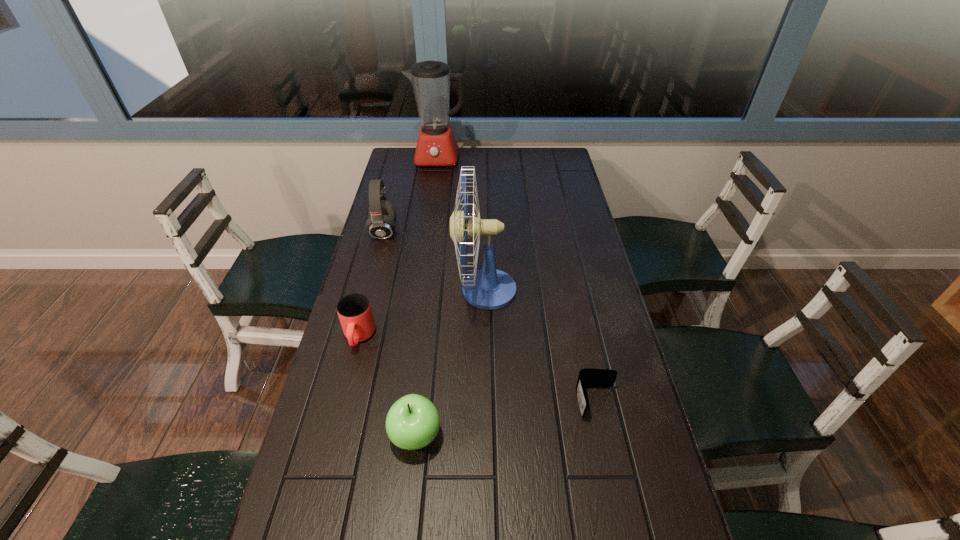
I want to click on object that is at the right edge, so click(x=589, y=376).

Find the location of a particular element. The height and width of the screenshot is (540, 960). object present at the far left corner is located at coordinates (436, 146).

Where is `vacant space at the far edge`? vacant space at the far edge is located at coordinates (434, 171).

In the image, there is a desktop. At what (x,y) coordinates should I click in order to perform the action: click on vacant area at the left edge. Please return your answer as a coordinate pair (x, y). Image resolution: width=960 pixels, height=540 pixels. Looking at the image, I should click on (310, 485).

I want to click on vacant space at the right edge of the desktop, so click(x=568, y=293).

Locate an element on the screen. free space between the fan and the apple is located at coordinates (450, 363).

Locate an element on the screen. This screenshot has width=960, height=540. free point between the farthest object and the cup is located at coordinates (398, 248).

This screenshot has width=960, height=540. Identify the location of free spot between the cup and the fan. (422, 313).

Find the location of a particular element. This screenshot has width=960, height=540. empty location between the fifth nearest object and the wallet is located at coordinates (491, 316).

What are the coordinates of `vacant area that lies between the cup and the apple` in the screenshot? It's located at (387, 387).